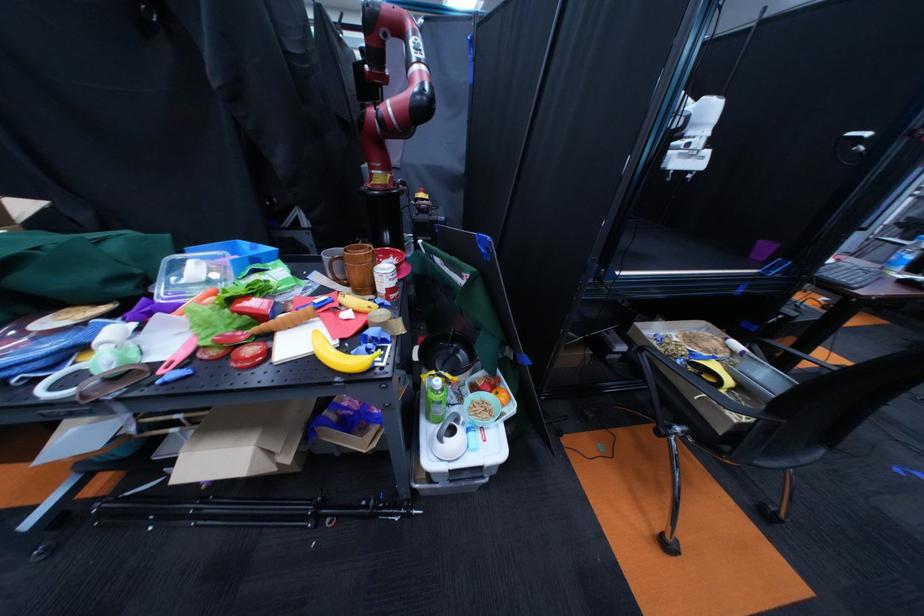
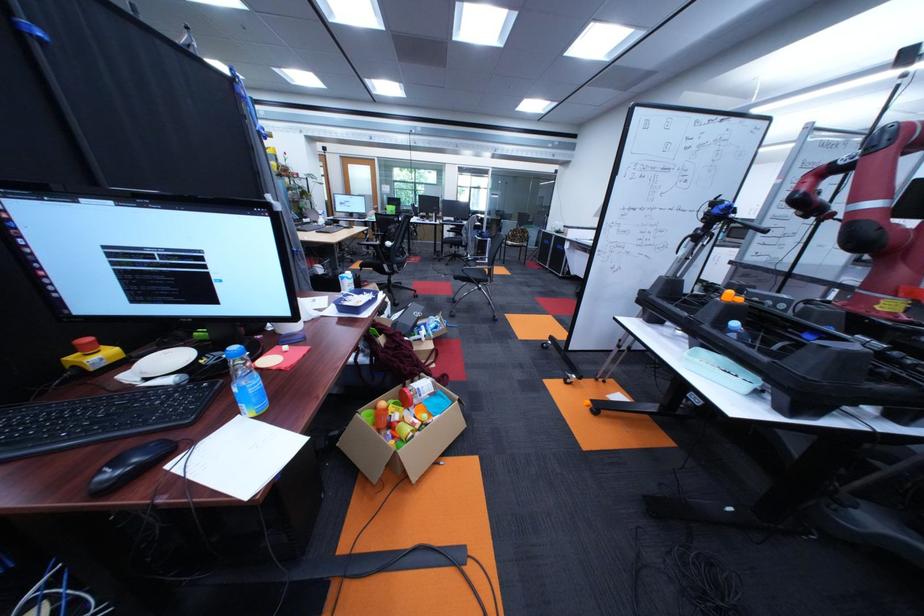
Question: The images are taken continuously from a first-person perspective. In which direction are you moving?

Choices:
 (A) Left
 (B) Right
 (C) Forward
 (D) Backward

Answer: (B)